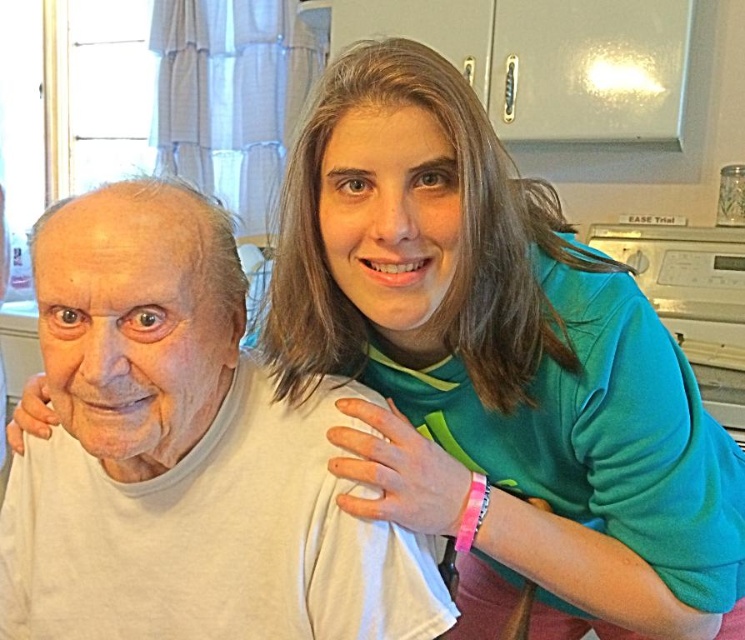
How distant is teal matte sweatshirt at upper right from white matte t-shirt at center?

teal matte sweatshirt at upper right is 6.92 inches from white matte t-shirt at center.

Consider the image. Does teal matte sweatshirt at upper right have a greater height compared to white matte t-shirt at center?

Correct, teal matte sweatshirt at upper right is much taller as white matte t-shirt at center.

Locate an element on the screen. This screenshot has width=745, height=640. teal matte sweatshirt at upper right is located at coordinates (498, 365).